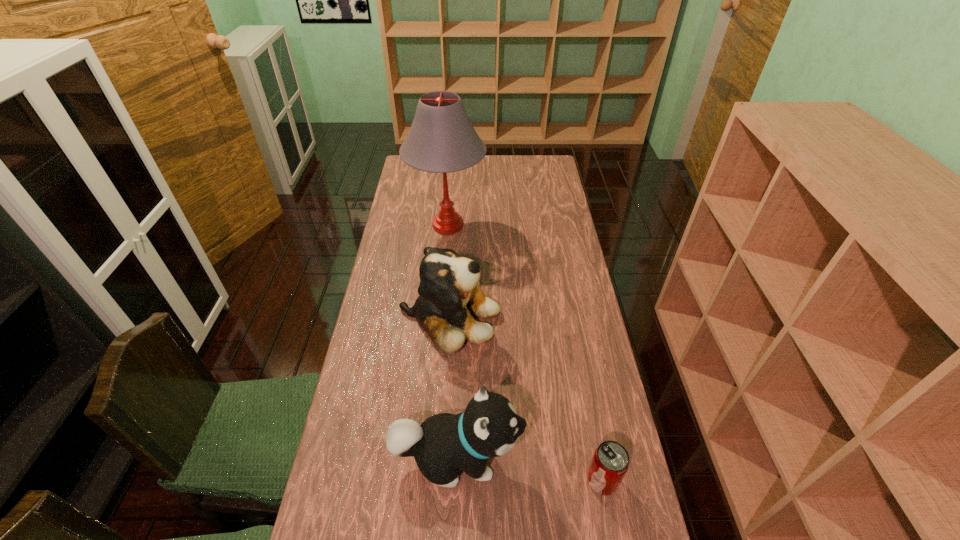
Locate an element on the screen. The width and height of the screenshot is (960, 540). table lamp located at the left edge is located at coordinates (442, 139).

Locate an element on the screen. This screenshot has width=960, height=540. object that is at the right edge is located at coordinates (610, 462).

The image size is (960, 540). In order to click on free spot at the far edge of the desktop in this screenshot , I will do `click(478, 172)`.

In the image, there is a desktop. Where is `free space at the left edge`? The height and width of the screenshot is (540, 960). free space at the left edge is located at coordinates (401, 249).

What are the coordinates of `vacant space at the right edge of the desktop` in the screenshot? It's located at (579, 456).

Locate an element on the screen. vacant space at the far right corner of the desktop is located at coordinates (538, 178).

Identify the location of unoccupied area between the pop soda and the farther puppy. The width and height of the screenshot is (960, 540). (526, 399).

Locate an element on the screen. This screenshot has width=960, height=540. free space between the nearer puppy and the pop soda is located at coordinates (530, 469).

The width and height of the screenshot is (960, 540). What are the coordinates of `vacant space that is in between the pop soda and the tallest object` in the screenshot? It's located at (525, 353).

Find the location of `free space between the second farthest object and the pop soda`. free space between the second farthest object and the pop soda is located at coordinates (526, 399).